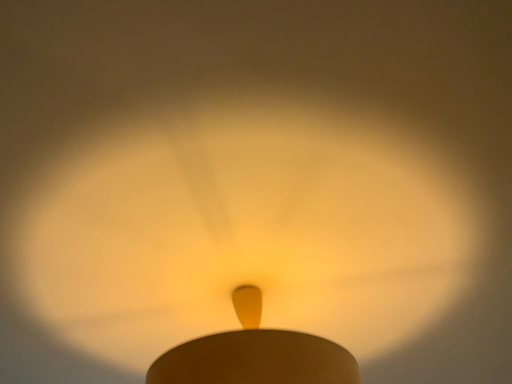
Describe the element at coordinates (245, 232) in the screenshot. I see `matte yellow light at center` at that location.

Find the location of `matte yellow light at center`. matte yellow light at center is located at coordinates click(x=245, y=232).

At what (x,y) coordinates should I click in order to perform the action: click on matte yellow light at center. Please return your answer as a coordinate pair (x, y). This screenshot has width=512, height=384. Looking at the image, I should click on (245, 232).